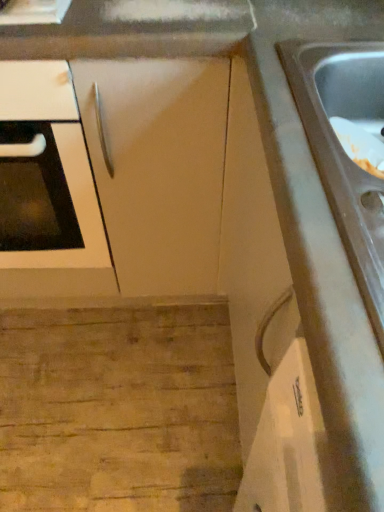
Question: Considering the relative sizes of stainless steel sink at right and matte white cabinet at center in the image provided, is stainless steel sink at right shorter than matte white cabinet at center?

Choices:
 (A) no
 (B) yes

Answer: (B)

Question: From a real-world perspective, is stainless steel sink at right located higher than matte white cabinet at center?

Choices:
 (A) yes
 (B) no

Answer: (A)

Question: Is stainless steel sink at right facing towards matte white cabinet at center?

Choices:
 (A) no
 (B) yes

Answer: (A)

Question: Can you confirm if stainless steel sink at right is taller than matte white cabinet at center?

Choices:
 (A) yes
 (B) no

Answer: (B)

Question: From a real-world perspective, is stainless steel sink at right under matte white cabinet at center?

Choices:
 (A) yes
 (B) no

Answer: (B)

Question: Considering the relative positions of matte white cabinet at center and stainless steel sink at right in the image provided, is matte white cabinet at center to the left or to the right of stainless steel sink at right?

Choices:
 (A) left
 (B) right

Answer: (A)

Question: From the image's perspective, is matte white cabinet at center located above or below stainless steel sink at right?

Choices:
 (A) below
 (B) above

Answer: (B)

Question: Is matte white cabinet at center inside or outside of stainless steel sink at right?

Choices:
 (A) outside
 (B) inside

Answer: (A)

Question: Does point (135, 245) appear closer or farther from the camera than point (375, 64)?

Choices:
 (A) farther
 (B) closer

Answer: (A)

Question: Would you say white glossy oven at left is to the left or to the right of matte white cabinet at center in the picture?

Choices:
 (A) left
 (B) right

Answer: (A)

Question: From their relative heights in the image, would you say white glossy oven at left is taller or shorter than matte white cabinet at center?

Choices:
 (A) short
 (B) tall

Answer: (B)

Question: Is white glossy oven at left spatially inside matte white cabinet at center, or outside of it?

Choices:
 (A) outside
 (B) inside

Answer: (A)

Question: From the image's perspective, relative to matte white cabinet at center, is white glossy oven at left above or below?

Choices:
 (A) above
 (B) below

Answer: (B)

Question: Is matte white cabinet at center taller or shorter than white glossy oven at left?

Choices:
 (A) tall
 (B) short

Answer: (B)

Question: From the image's perspective, is matte white cabinet at center positioned above or below white glossy oven at left?

Choices:
 (A) above
 (B) below

Answer: (A)